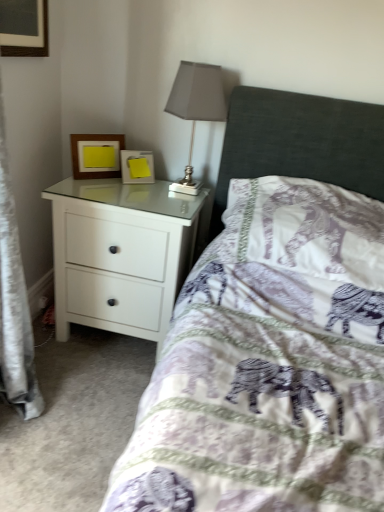
Question: From a real-world perspective, is matte gray lampshade at upper center on top of purple elephant-patterned pillow at center?

Choices:
 (A) no
 (B) yes

Answer: (B)

Question: From the image's perspective, is matte gray lampshade at upper center located beneath purple elephant-patterned pillow at center?

Choices:
 (A) yes
 (B) no

Answer: (B)

Question: Does matte gray lampshade at upper center have a larger size compared to purple elephant-patterned pillow at center?

Choices:
 (A) yes
 (B) no

Answer: (B)

Question: Considering the relative sizes of matte gray lampshade at upper center and purple elephant-patterned pillow at center in the image provided, is matte gray lampshade at upper center thinner than purple elephant-patterned pillow at center?

Choices:
 (A) no
 (B) yes

Answer: (B)

Question: Is matte gray lampshade at upper center positioned with its back to purple elephant-patterned pillow at center?

Choices:
 (A) yes
 (B) no

Answer: (B)

Question: Is wooden picture frame at upper left, the second picture frame in the right-to-left sequence, inside the boundaries of matte gray lampshade at upper center, or outside?

Choices:
 (A) inside
 (B) outside

Answer: (B)

Question: Is wooden picture frame at upper left, placed as the first picture frame when sorted from left to right, wider or thinner than matte gray lampshade at upper center?

Choices:
 (A) wide
 (B) thin

Answer: (B)

Question: Considering the positions of wooden picture frame at upper left, the second picture frame in the right-to-left sequence, and matte gray lampshade at upper center in the image, is wooden picture frame at upper left, the second picture frame in the right-to-left sequence, taller or shorter than matte gray lampshade at upper center?

Choices:
 (A) short
 (B) tall

Answer: (A)

Question: Considering their positions, is wooden picture frame at upper left, placed as the first picture frame when sorted from left to right, located in front of or behind matte gray lampshade at upper center?

Choices:
 (A) behind
 (B) front

Answer: (A)

Question: Which is correct: white glossy chest of drawers at left is inside yellow paper at upper left, which is counted as the first picture frame, starting from the right, or outside of it?

Choices:
 (A) outside
 (B) inside

Answer: (A)

Question: In the image, is white glossy chest of drawers at left positioned in front of or behind yellow paper at upper left, which is counted as the first picture frame, starting from the right?

Choices:
 (A) behind
 (B) front

Answer: (B)

Question: Is point (167, 291) positioned closer to the camera than point (144, 174)?

Choices:
 (A) closer
 (B) farther

Answer: (A)

Question: In terms of height, does white glossy chest of drawers at left look taller or shorter compared to yellow paper at upper left, the 2th picture frame when ordered from left to right?

Choices:
 (A) short
 (B) tall

Answer: (B)

Question: Is purple elephant-patterned pillow at center situated inside wooden picture frame at upper left, the second picture frame in the right-to-left sequence, or outside?

Choices:
 (A) inside
 (B) outside

Answer: (B)

Question: From the image's perspective, relative to wooden picture frame at upper left, the second picture frame in the right-to-left sequence, is purple elephant-patterned pillow at center above or below?

Choices:
 (A) above
 (B) below

Answer: (B)